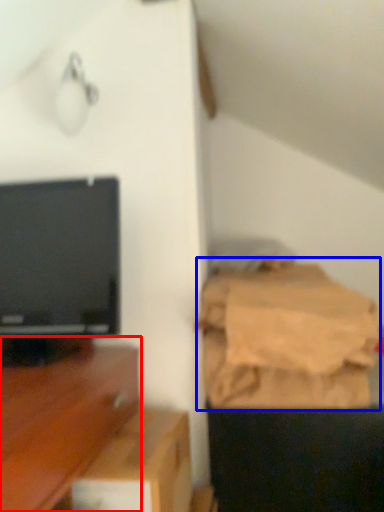
Question: Which point is further to the camera, furniture (highlighted by a red box) or sheet (highlighted by a blue box)?

Choices:
 (A) furniture
 (B) sheet

Answer: (B)